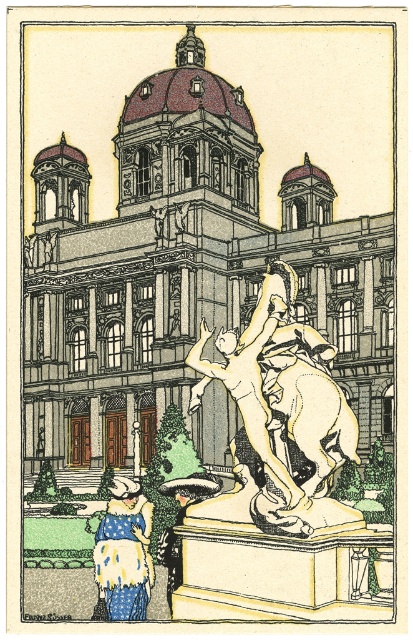
Question: Which point appears farthest from the camera in this image?

Choices:
 (A) (285, 412)
 (B) (128, 483)

Answer: (B)

Question: Can you confirm if gold polished statue at center is smaller than white dotted dress at lower left?

Choices:
 (A) yes
 (B) no

Answer: (B)

Question: Is the position of gold polished statue at center more distant than that of white dotted dress at lower left?

Choices:
 (A) yes
 (B) no

Answer: (B)

Question: Which of the following is the closest to the observer?

Choices:
 (A) white dotted dress at lower left
 (B) gold polished statue at center

Answer: (B)

Question: Does gold polished statue at center have a smaller size compared to white dotted dress at lower left?

Choices:
 (A) yes
 (B) no

Answer: (B)